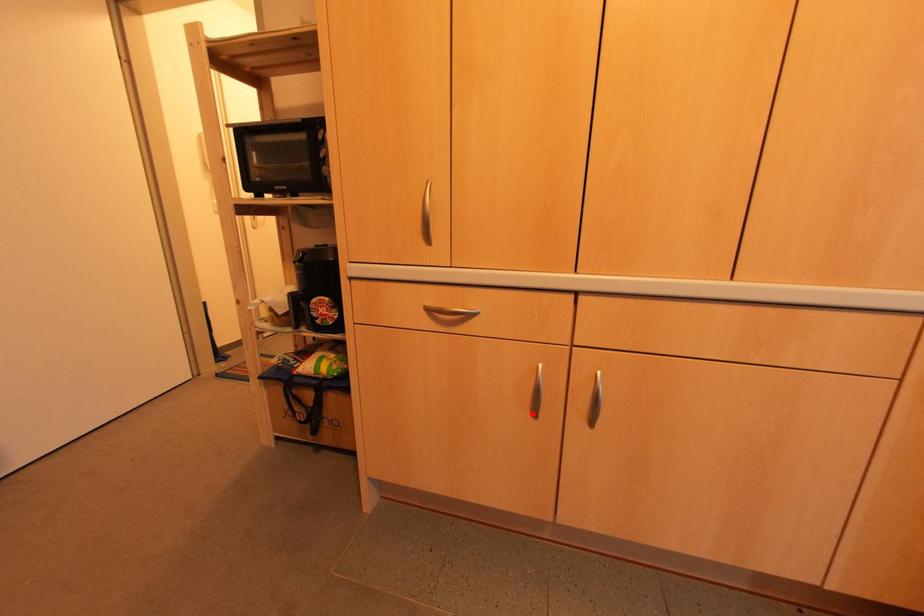
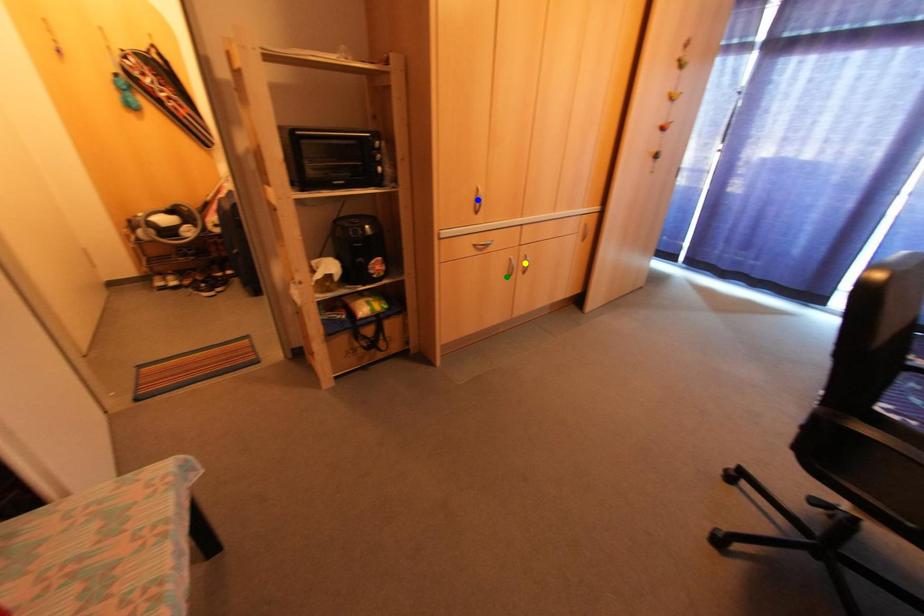
Question: I am providing you with two images of the same scene from different viewpoints. A red point is marked on the first image. You are given multiple points on the second image. Can you choose the point in image 2 that corresponds to the point in image 1?

Choices:
 (A) blue point
 (B) yellow point
 (C) green point

Answer: (C)